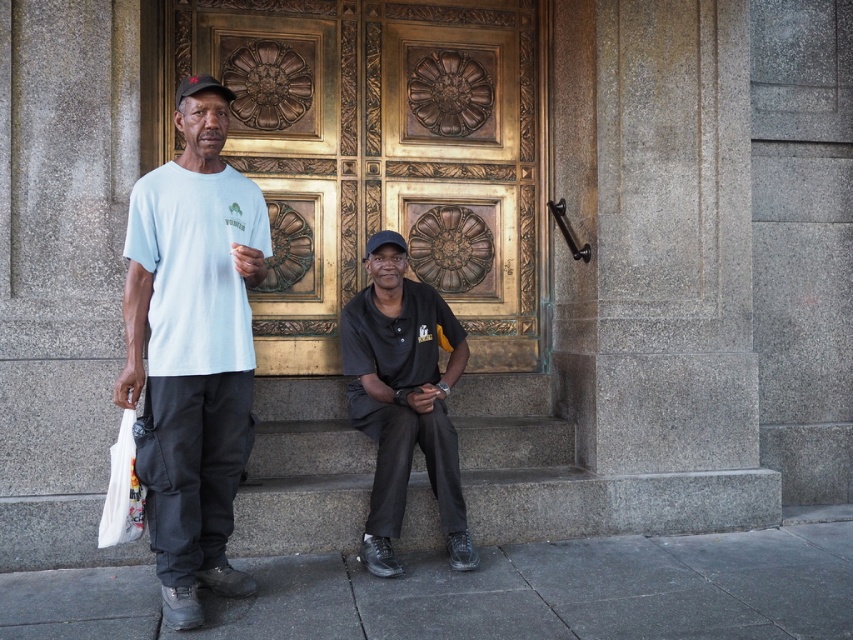
You are trying to place a small potted plant between the gray concrete stairs at lower center and the black fabric baseball cap at center. Based on their sizes, will the plant fit comfortably between them?

The gray concrete stairs at lower center might be wider than black fabric baseball cap at center, so there might be enough space for the plant to fit comfortably between them.

You are a photographer aiming to capture a wide shot of both the gray concrete stairs at lower center and the black matte shirt at center without any cropping. Given their widths, which object should you position closer to the camera to ensure both fit in the frame?

Since the gray concrete stairs at lower center is wider than the black matte shirt at center, you should position the gray concrete stairs at lower center closer to the camera to ensure both fit in the frame without cropping.